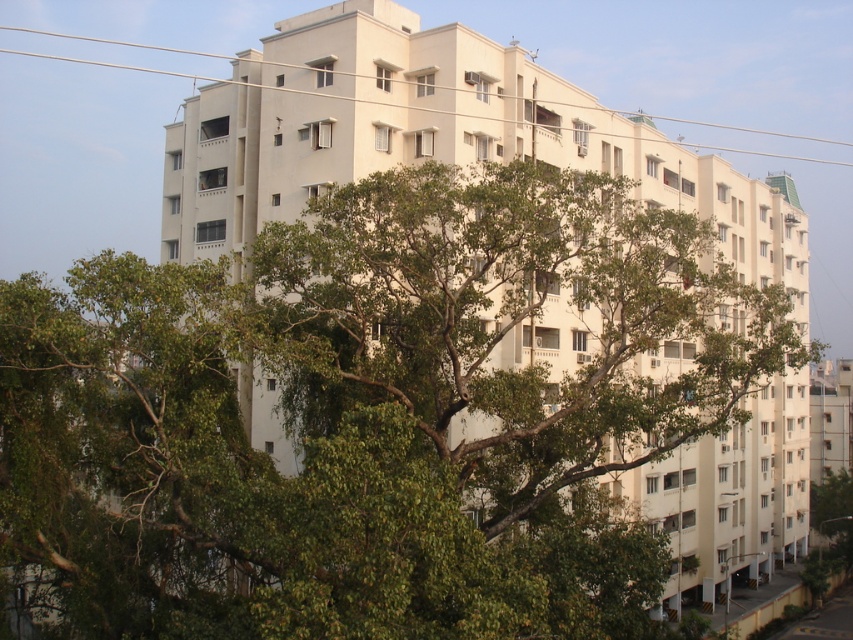
Question: Does green leafy tree at center come behind white plastic power line at upper center?

Choices:
 (A) no
 (B) yes

Answer: (A)

Question: Is green leafy tree at center positioned before white plastic power line at upper center?

Choices:
 (A) yes
 (B) no

Answer: (A)

Question: Which of the following is the closest to the observer?

Choices:
 (A) (767, 131)
 (B) (364, 584)

Answer: (B)

Question: Is green leafy tree at center further to camera compared to white plastic power line at upper center?

Choices:
 (A) no
 (B) yes

Answer: (A)